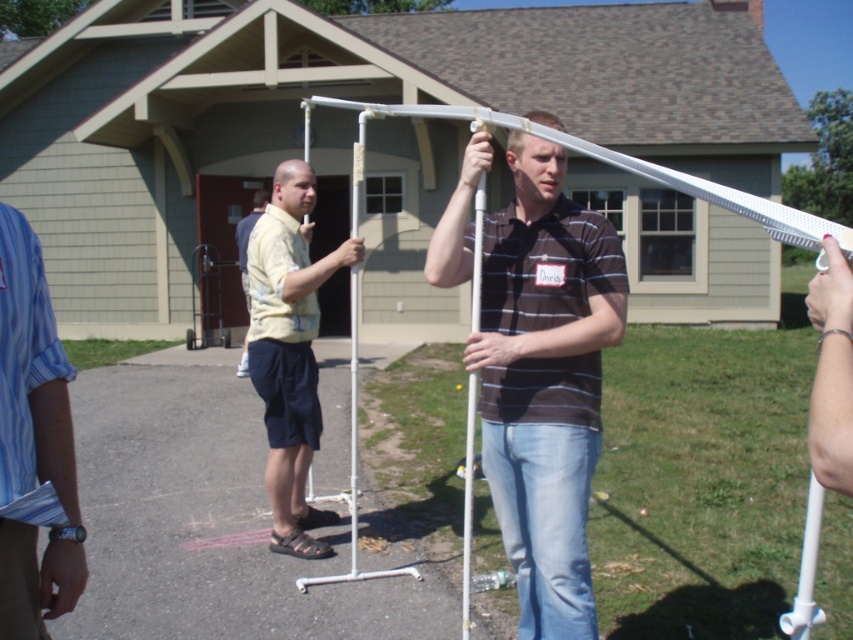
You are a delivery person who needs to place a 1.5 meter long package between the yellow printed shirt at center and the white plastic pole at center. Is there enough space?

The distance between the yellow printed shirt at center and the white plastic pole at center is 1.17 meters, which is shorter than the 1.5 meter package. Therefore, there isn not enough space to place the package between them.

You are a photographer standing in the scene and want to capture both the skinny silver bracelet at upper right and the white plastic pole at center in your photo. Which object should you focus on first to ensure both are in clear view?

You should focus on the skinny silver bracelet at upper right first because it is closer to you than the white plastic pole at center, ensuring both will be in clear view once properly focused.

You are a photographer taking a picture of the scene. You notice the yellow printed shirt at center and the white plastic pole at center. Which object should you focus on if you want to capture the larger object in your shot?

The yellow printed shirt at center is bigger than the white plastic pole at center, so you should focus on the yellow printed shirt at center to capture the larger object.